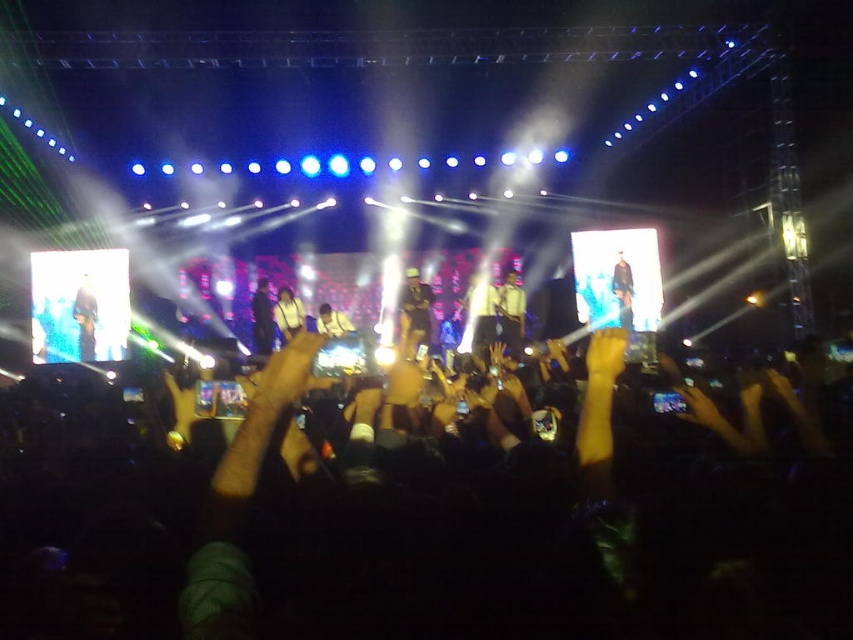
You are standing at the point with coordinates point (618, 264) and want to move to the point with coordinates point (473, 317). Is there a clear path between the two points?

Point (473, 317) is behind point (618, 264), so there is no clear path between them because the point (618, 264) is blocking the way.

You are a photographer at the concert. You want to take a photo of the yellow shirt at center and dark blue jeans at center. Which one should you focus on if you want the wider object to be in sharp focus?

The yellow shirt at center might be wider than dark blue jeans at center, so you should focus on the yellow shirt at center to ensure the wider object is in sharp focus.

You are a photographer at the concert. You want to take a photo of both the dark brown leather jacket at center and the dark blue leather jacket at center. Which jacket should you focus on first if you want to capture the one that is taller?

The dark brown leather jacket at center is taller than the dark blue leather jacket at center, so you should focus on the dark brown leather jacket at center first.